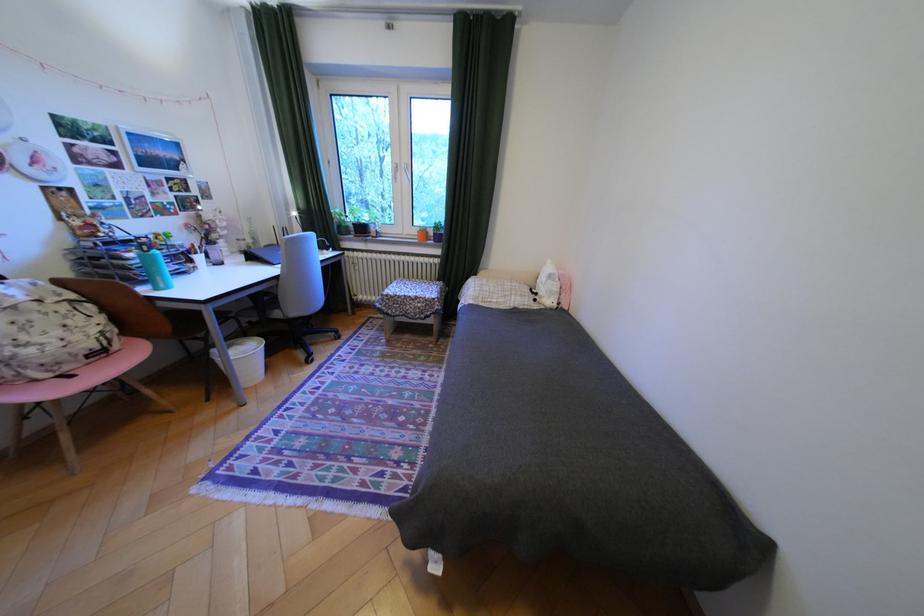
You are a GUI agent. You are given a task and a screenshot of the screen. Output one action in this format:
    pyautogui.click(x=<x>, y=<y>)
    Task: Click on the pink chair sitting surface
    Image resolution: width=924 pixels, height=616 pixels.
    Given the screenshot: What is the action you would take?
    pyautogui.click(x=103, y=367)